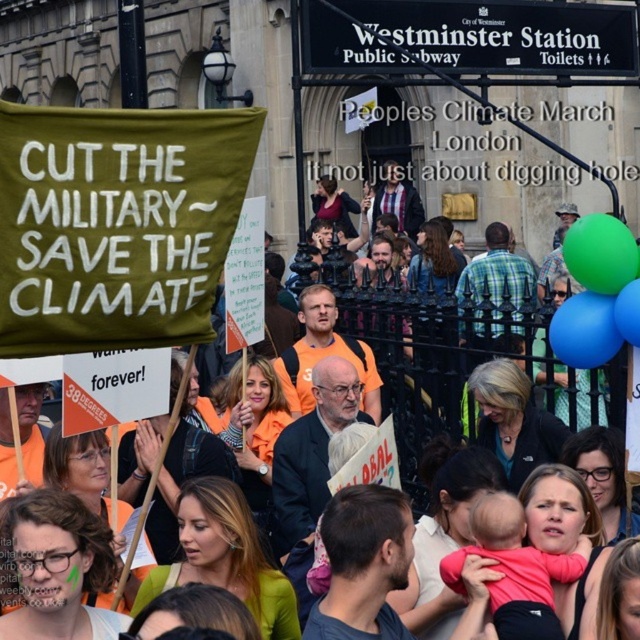
What is the spatial relationship between the green fabric banner at upper left and the pink fabric baby at lower center?

The green fabric banner at upper left is positioned over the pink fabric baby at lower center.

What is located at the coordinates point (440, 348)?

At point (440, 348) lies the green fabric banner at upper left.

What is the relationship between the size of the green fabric banner at upper left and the pink fabric baby at lower center?

The green fabric banner at upper left is wider than the pink fabric baby at lower center.